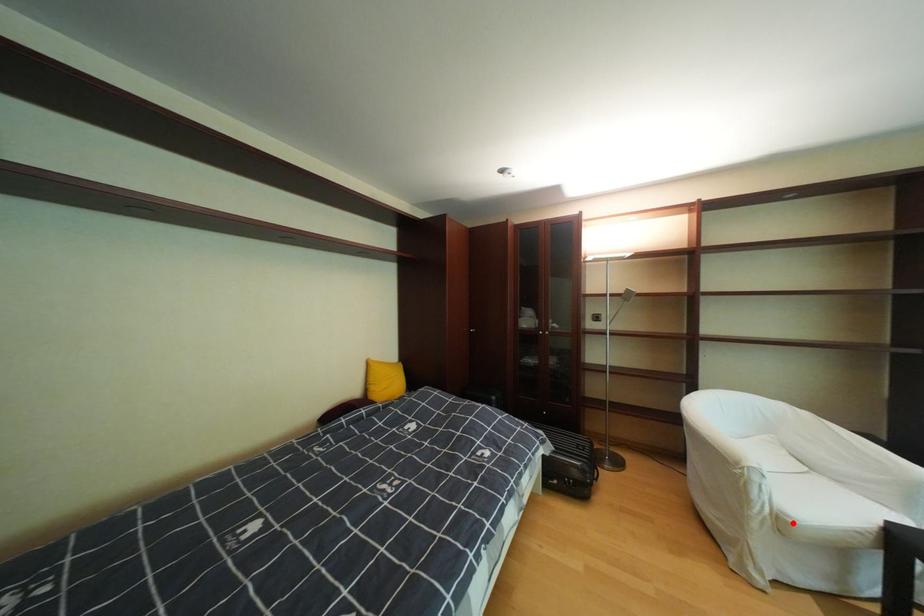
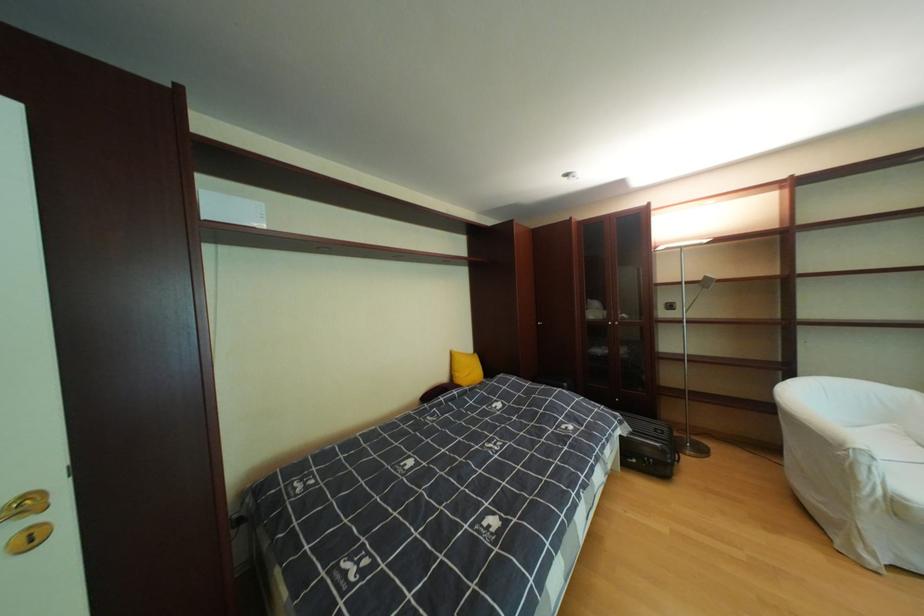
Question: I am providing you with two images of the same scene from different viewpoints. Image1 has a red point marked. In image2, the corresponding 3D location appears at what relative position? Reply with the corresponding letter.

Choices:
 (A) Closer
 (B) Farther

Answer: (A)